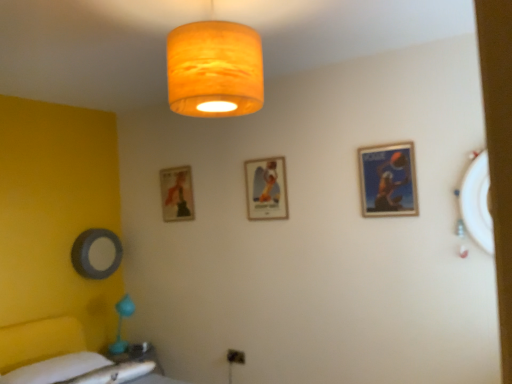
At what (x,y) coordinates should I click in order to perform the action: click on matte gold picture frame at center left, the 1th picture frame positioned from the left. Please return your answer as a coordinate pair (x, y). The image size is (512, 384). Looking at the image, I should click on (177, 194).

What do you see at coordinates (266, 188) in the screenshot?
I see `matte gold picture frame at center, the 2th picture frame in the back-to-front sequence` at bounding box center [266, 188].

Measure the distance between matte white table at lower left and camera.

matte white table at lower left is 3.13 meters from camera.

What is the approximate height of matte blue poster at upper right, the first picture frame in the right-to-left sequence?

17.45 inches.

Locate an element on the screen. The height and width of the screenshot is (384, 512). white fabric bedsheet at lower left is located at coordinates (56, 369).

Find the location of a particular element. The width and height of the screenshot is (512, 384). matte gold picture frame at center left, the 1th picture frame positioned from the back is located at coordinates (177, 194).

Is white fabric bedsheet at lower left wider or thinner than matte blue poster at upper right, the first picture frame in the right-to-left sequence?

white fabric bedsheet at lower left is wider than matte blue poster at upper right, the first picture frame in the right-to-left sequence.

Would you say white fabric bedsheet at lower left contains matte blue poster at upper right, the first picture frame in the right-to-left sequence?

No, matte blue poster at upper right, the first picture frame in the right-to-left sequence, is not surrounded by white fabric bedsheet at lower left.

From a real-world perspective, is white fabric bedsheet at lower left located higher than matte blue poster at upper right, the third picture frame positioned from the back?

No.

Can you confirm if white fabric bedsheet at lower left is taller than matte blue poster at upper right, the first picture frame in the right-to-left sequence?

No.

Is point (178, 207) positioned in front of point (367, 173)?

No, it is not.

Looking at this image, does matte gold picture frame at center left, the 1th picture frame positioned from the back, have a greater height compared to matte blue poster at upper right, the first picture frame in the right-to-left sequence?

Correct, matte gold picture frame at center left, the 1th picture frame positioned from the back, is much taller as matte blue poster at upper right, the first picture frame in the right-to-left sequence.

Is matte gold picture frame at center left, the 1th picture frame positioned from the left, at the right side of matte blue poster at upper right, the third picture frame positioned from the back?

In fact, matte gold picture frame at center left, the 1th picture frame positioned from the left, is to the left of matte blue poster at upper right, the third picture frame positioned from the back.

Is matte gold picture frame at center left, which is the 3th picture frame from right to left, positioned far away from matte blue poster at upper right, the first picture frame in the front-to-back sequence?

matte gold picture frame at center left, which is the 3th picture frame from right to left, is positioned a significant distance from matte blue poster at upper right, the first picture frame in the front-to-back sequence.

Which is behind, point (194, 97) or point (52, 362)?

Positioned behind is point (52, 362).

Is matte orange fabric lampshade at upper center not close to white fabric bedsheet at lower left?

Yes, matte orange fabric lampshade at upper center and white fabric bedsheet at lower left are quite far apart.

Is matte orange fabric lampshade at upper center facing towards white fabric bedsheet at lower left?

No, matte orange fabric lampshade at upper center is not oriented towards white fabric bedsheet at lower left.

Is matte orange fabric lampshade at upper center taller than white fabric bedsheet at lower left?

Indeed, matte orange fabric lampshade at upper center has a greater height compared to white fabric bedsheet at lower left.

Between matte blue poster at upper right, the first picture frame in the front-to-back sequence, and white fabric bedsheet at lower left, which one is positioned behind?

matte blue poster at upper right, the first picture frame in the front-to-back sequence, is further from the camera.

Considering the sizes of objects matte blue poster at upper right, the third picture frame positioned from the back, and white fabric bedsheet at lower left in the image provided, who is thinner, matte blue poster at upper right, the third picture frame positioned from the back, or white fabric bedsheet at lower left?

matte blue poster at upper right, the third picture frame positioned from the back, is thinner.

Is matte blue poster at upper right, the first picture frame in the right-to-left sequence, aimed at white fabric bedsheet at lower left?

No.

Looking at their sizes, would you say matte white table at lower left is wider or thinner than matte blue poster at upper right, the first picture frame in the right-to-left sequence?

In the image, matte white table at lower left appears to be wider than matte blue poster at upper right, the first picture frame in the right-to-left sequence.

Is matte white table at lower left to the left of matte blue poster at upper right, acting as the third picture frame starting from the left, from the viewer's perspective?

Yes.

How different are the orientations of matte white table at lower left and matte blue poster at upper right, acting as the third picture frame starting from the left, in degrees?

The angle between the facing direction of matte white table at lower left and the facing direction of matte blue poster at upper right, acting as the third picture frame starting from the left, is 88.7 degrees.

Is point (153, 346) closer to camera compared to point (383, 207)?

No, (153, 346) is further to viewer.

Who is bigger, matte white table at lower left or matte gold picture frame at center, marked as the 2th picture frame in a right-to-left arrangement?

matte white table at lower left is bigger.

Could you tell me if matte white table at lower left is turned towards matte gold picture frame at center, the 2th picture frame in the back-to-front sequence?

No.

Considering the relative sizes of matte white table at lower left and matte gold picture frame at center, acting as the 2th picture frame starting from the front, in the image provided, is matte white table at lower left taller than matte gold picture frame at center, acting as the 2th picture frame starting from the front,?

No, matte white table at lower left is not taller than matte gold picture frame at center, acting as the 2th picture frame starting from the front.

Is matte gold picture frame at center, marked as the 2th picture frame in a right-to-left arrangement, inside matte white table at lower left?

No, matte white table at lower left does not contain matte gold picture frame at center, marked as the 2th picture frame in a right-to-left arrangement.

Considering the sizes of white fabric bedsheet at lower left and matte white table at lower left in the image, is white fabric bedsheet at lower left bigger or smaller than matte white table at lower left?

Clearly, white fabric bedsheet at lower left is smaller in size than matte white table at lower left.

Which of these two, white fabric bedsheet at lower left or matte white table at lower left, stands shorter?

white fabric bedsheet at lower left.

Looking at this image, from the image's perspective, is white fabric bedsheet at lower left positioned above or below matte white table at lower left?

Clearly, from the image's perspective, white fabric bedsheet at lower left is above matte white table at lower left.

The height and width of the screenshot is (384, 512). Find the location of `picture frame that is the 3rd one when counting rightward from the white fabric bedsheet at lower left`. picture frame that is the 3rd one when counting rightward from the white fabric bedsheet at lower left is located at coordinates (388, 180).

Locate an element on the screen. The height and width of the screenshot is (384, 512). picture frame that is the 2nd one when counting leftward from the matte blue poster at upper right, the first picture frame in the right-to-left sequence is located at coordinates (177, 194).

Looking at the image, which one is located closer to matte white table at lower left, matte orange fabric lampshade at upper center or matte gold picture frame at center, marked as the 2th picture frame in a right-to-left arrangement?

matte gold picture frame at center, marked as the 2th picture frame in a right-to-left arrangement, lies closer to matte white table at lower left than the other object.

Estimate the real-world distances between objects in this image. Which object is further from matte gold picture frame at center left, the 3th picture frame from the front, matte blue poster at upper right, the first picture frame in the front-to-back sequence, or white fabric bedsheet at lower left?

The object further to matte gold picture frame at center left, the 3th picture frame from the front, is matte blue poster at upper right, the first picture frame in the front-to-back sequence.

When comparing their distances from matte gold picture frame at center, placed as the second picture frame when sorted from left to right, does white fabric bedsheet at lower left or matte blue poster at upper right, acting as the third picture frame starting from the left, seem closer?

matte blue poster at upper right, acting as the third picture frame starting from the left, is closer to matte gold picture frame at center, placed as the second picture frame when sorted from left to right.

From the picture: Looking at the image, which one is located closer to matte gold picture frame at center, the 2th picture frame in the back-to-front sequence, matte orange fabric lampshade at upper center or matte white table at lower left?

Among the two, matte orange fabric lampshade at upper center is located nearer to matte gold picture frame at center, the 2th picture frame in the back-to-front sequence.

When comparing their distances from matte orange fabric lampshade at upper center, does matte gold picture frame at center, the 2th picture frame in the back-to-front sequence, or matte blue poster at upper right, acting as the third picture frame starting from the left, seem closer?

Based on the image, matte blue poster at upper right, acting as the third picture frame starting from the left, appears to be nearer to matte orange fabric lampshade at upper center.

Estimate the real-world distances between objects in this image. Which object is further from white fabric bedsheet at lower left, matte white table at lower left or matte gold picture frame at center, acting as the 2th picture frame starting from the front?

The object further to white fabric bedsheet at lower left is matte gold picture frame at center, acting as the 2th picture frame starting from the front.

Considering their positions, is matte gold picture frame at center, the 2th picture frame in the back-to-front sequence, positioned closer to matte gold picture frame at center left, which is the 3th picture frame from right to left, than matte white table at lower left?

Among the two, matte gold picture frame at center, the 2th picture frame in the back-to-front sequence, is located nearer to matte gold picture frame at center left, which is the 3th picture frame from right to left.

Estimate the real-world distances between objects in this image. Which object is further from white fabric bedsheet at lower left, matte gold picture frame at center left, which is the 3th picture frame from right to left, or matte orange fabric lampshade at upper center?

The object further to white fabric bedsheet at lower left is matte orange fabric lampshade at upper center.

The image size is (512, 384). I want to click on table between white fabric bedsheet at lower left and matte blue poster at upper right, the first picture frame in the front-to-back sequence, in the horizontal direction, so click(138, 355).

Locate an element on the screen. sheet that lies between matte gold picture frame at center left, which is the 3th picture frame from right to left, and matte white table at lower left from top to bottom is located at coordinates (56, 369).

Where is `sheet between matte gold picture frame at center, marked as the 2th picture frame in a right-to-left arrangement, and matte white table at lower left, in the vertical direction`? sheet between matte gold picture frame at center, marked as the 2th picture frame in a right-to-left arrangement, and matte white table at lower left, in the vertical direction is located at coordinates (56, 369).

Find the location of a particular element. Image resolution: width=512 pixels, height=384 pixels. lamp between white fabric bedsheet at lower left and matte blue poster at upper right, the third picture frame positioned from the back, in the horizontal direction is located at coordinates (214, 69).